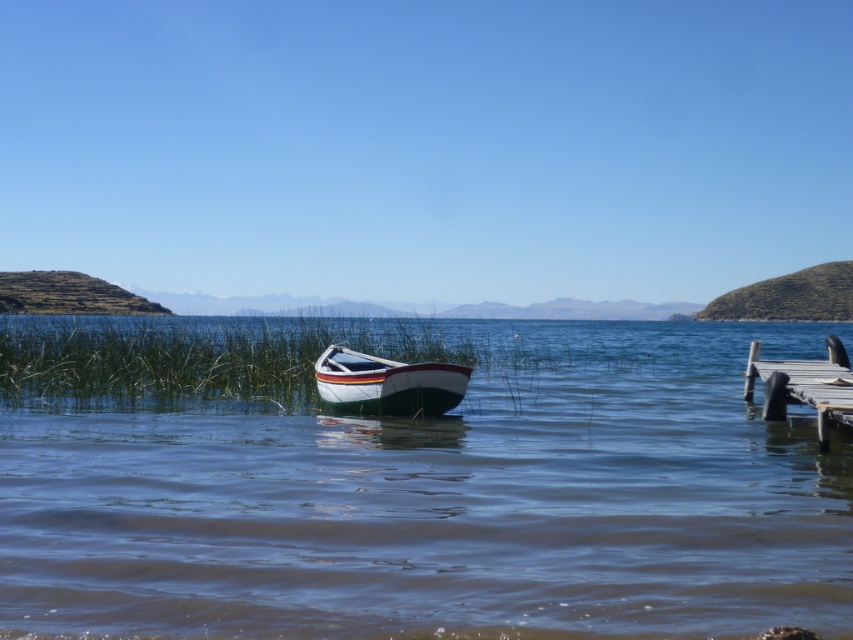
You are standing at the edge of the lakeside and want to check the water quality at point (412,483). According to the scene, what is present at that location?

At point (412,483) lies clear blue water at center.

In the scene shown: You are standing on the wooden dock at lower right and want to reach the clear blue water at center. Which direction should you move to get there?

To reach the clear blue water at center from the wooden dock at lower right, move to the left since the clear blue water at center is located to the right of the wooden dock at lower right.

You are standing at the shore of the lake and want to reach a specific point marked as point (407, 620). Given that the distance from your current position to this point is 5.37 meters, can you estimate how far you need to walk to reach it?

The distance of point (407, 620) from the camera is 5.37 meters, so you need to walk approximately 5.37 meters to reach it.